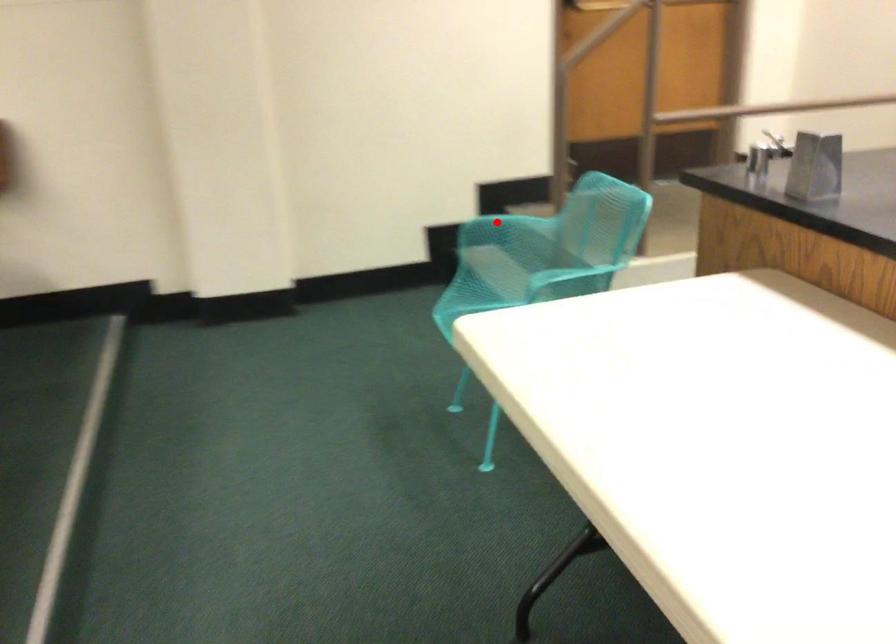
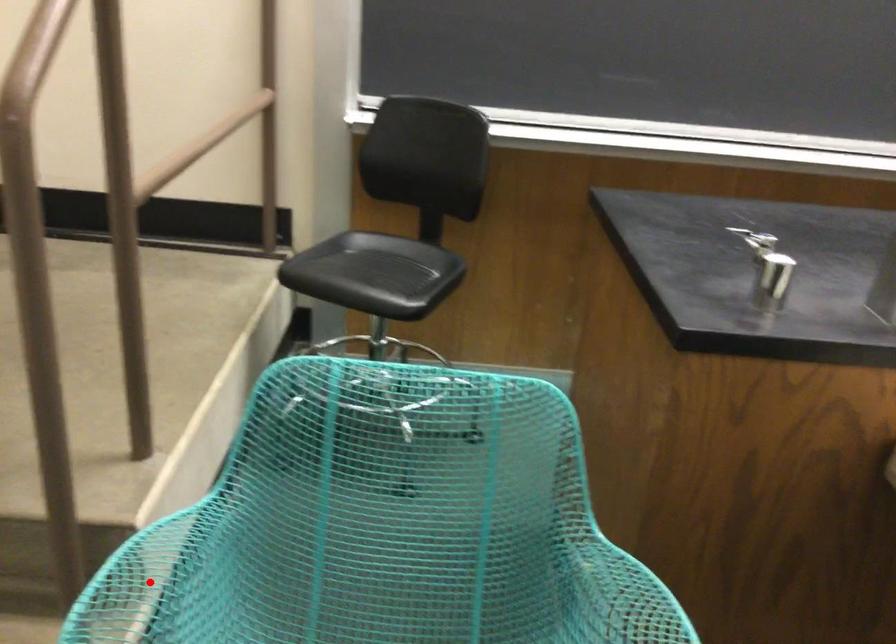
I am providing you with two images of the same scene from different viewpoints. A red point is marked on the first image and another point is marked on the second image. Is the marked point in image1 the same physical position as the marked point in image2?

Yes